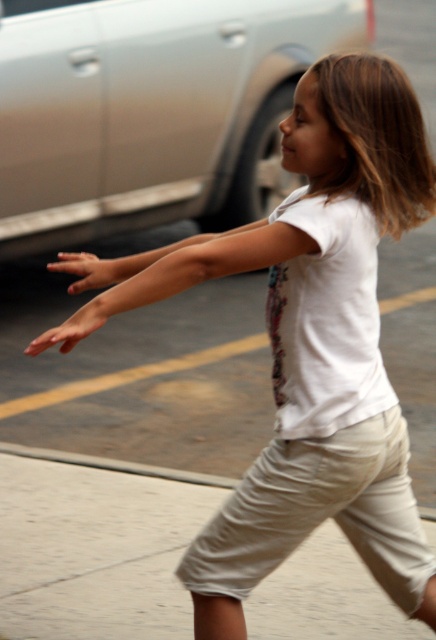
You are a photographer trying to capture the girl in the image. You need to ensure that both the khaki cotton shorts at lower right and the smooth concrete curb at lower center are clearly visible in the photo. Given their sizes, which object should you focus on to ensure both are in focus?

The khaki cotton shorts at lower right is bigger than the smooth concrete curb at lower center, so focusing on the khaki cotton shorts at lower right will ensure both are in focus since it is larger and occupies more space in the frame.

Consider the image. You are a photographer trying to capture the girl running towards the khaki cotton shorts at lower right and the smooth concrete curb at lower center. Which object will the girl reach first?

The khaki cotton shorts at lower right will be reached first because it is positioned in front of the smooth concrete curb at lower center.